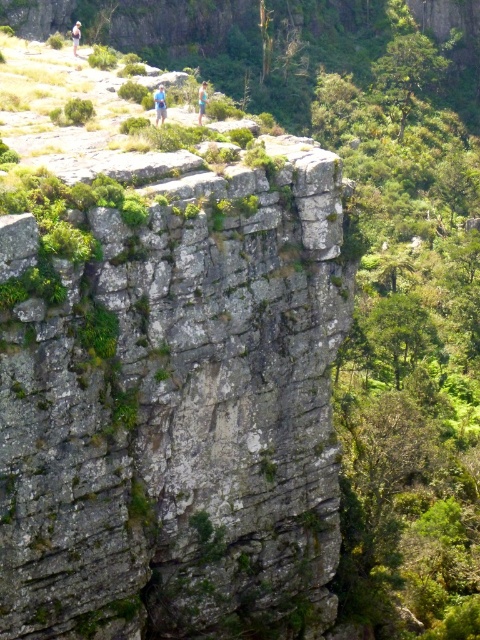
Question: Is blue fabric person at upper center below blue fabric shirt at upper center?

Choices:
 (A) no
 (B) yes

Answer: (B)

Question: Which object appears closest to the camera in this image?

Choices:
 (A) blue fabric shirt at upper center
 (B) blue fabric person at upper center
 (C) blue denim shorts at upper left

Answer: (B)

Question: Among these objects, which one is nearest to the camera?

Choices:
 (A) blue denim shorts at upper left
 (B) blue fabric shirt at upper center

Answer: (B)

Question: Which of the following is the farthest from the observer?

Choices:
 (A) (160, 108)
 (B) (204, 106)
 (C) (72, 36)

Answer: (C)

Question: Can you confirm if blue fabric person at upper center is positioned below blue fabric shirt at upper center?

Choices:
 (A) no
 (B) yes

Answer: (B)

Question: Can you confirm if blue fabric person at upper center is smaller than blue fabric shirt at upper center?

Choices:
 (A) no
 (B) yes

Answer: (B)